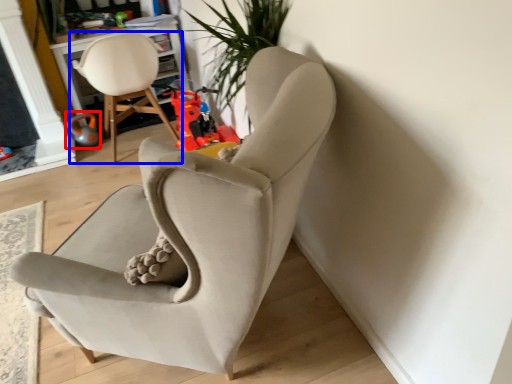
Question: Which object is closer to the camera taking this photo, toy (highlighted by a red box) or chair (highlighted by a blue box)?

Choices:
 (A) toy
 (B) chair

Answer: (B)